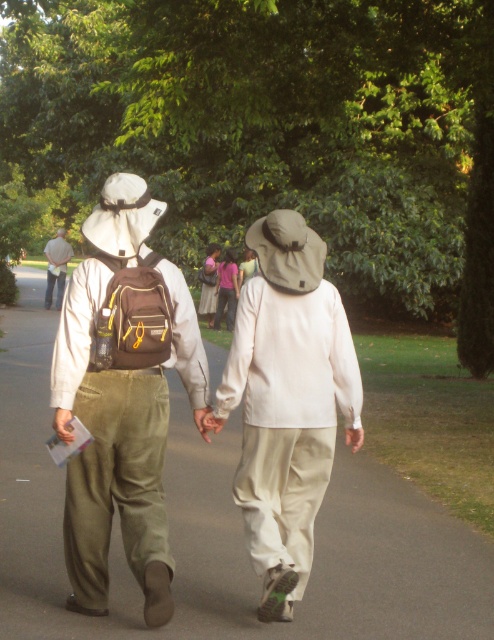
How far apart are matte pink shirt at center and matte brown backpack at upper left?

matte pink shirt at center and matte brown backpack at upper left are 6.88 meters apart.

What do you see at coordinates (231, 285) in the screenshot? The width and height of the screenshot is (494, 640). I see `matte pink shirt at center` at bounding box center [231, 285].

Does point (215, 308) come closer to viewer compared to point (48, 250)?

Yes, point (215, 308) is closer to viewer.

The height and width of the screenshot is (640, 494). What are the coordinates of `matte pink shirt at center` in the screenshot? It's located at (231, 285).

Does smooth asphalt path at center appear on the left side of matte brown backpack at upper left?

Incorrect, smooth asphalt path at center is not on the left side of matte brown backpack at upper left.

Is smooth asphalt path at center closer to the viewer compared to matte brown backpack at upper left?

Yes.

Identify the location of smooth asphalt path at center. tap(224, 531).

Is smooth asphalt path at center closer to the viewer compared to matte pink shirt at center?

That is True.

Who is shorter, smooth asphalt path at center or matte pink shirt at center?

Standing shorter between the two is smooth asphalt path at center.

Locate an element on the screen. smooth asphalt path at center is located at coordinates (224, 531).